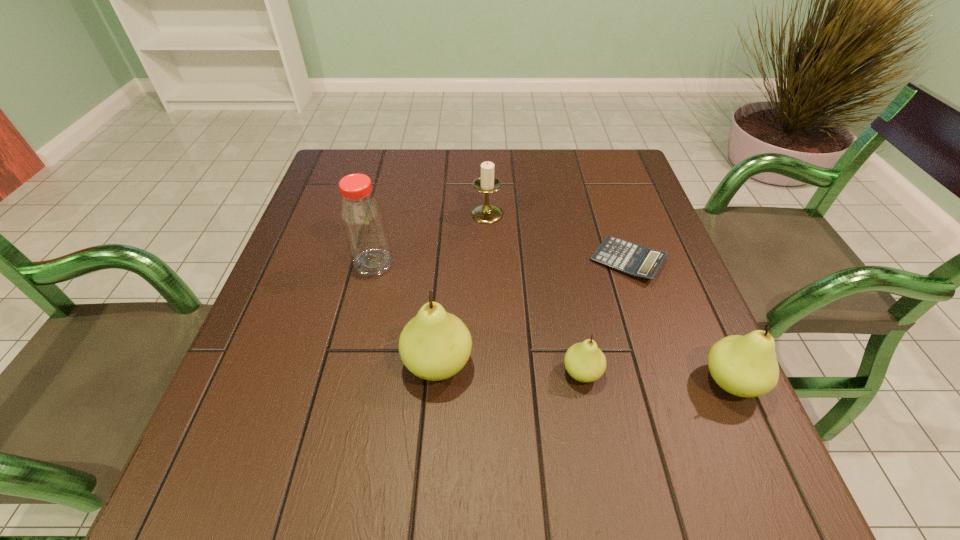
Identify the location of empty location between the farthest object and the leftmost pear. This screenshot has height=540, width=960. (463, 289).

Choose which object is the second nearest neighbor to the bottle. Please provide its 2D coordinates. Your answer should be formatted as a tuple, i.e. [(x, y)], where the tuple contains the x and y coordinates of a point satisfying the conditions above.

[(487, 183)]

Select which object appears as the third closest to the fourth object from left to right. Please provide its 2D coordinates. Your answer should be formatted as a tuple, i.e. [(x, y)], where the tuple contains the x and y coordinates of a point satisfying the conditions above.

[(638, 261)]

Identify the location of pear identified as the closest to the leftmost pear. [585, 362].

Locate which pear ranks in proximity to the rightmost pear. Please provide its 2D coordinates. Your answer should be formatted as a tuple, i.e. [(x, y)], where the tuple contains the x and y coordinates of a point satisfying the conditions above.

[(585, 362)]

You are a GUI agent. You are given a task and a screenshot of the screen. Output one action in this format:
    pyautogui.click(x=<x>, y=<y>)
    Task: Click on the free space that satisfies the following two spatial constraints: 1. on the front side of the leftmost object; 2. on the right side of the leftmost pear
    
    Given the screenshot: What is the action you would take?
    pyautogui.click(x=349, y=364)

At what (x,y) coordinates should I click in order to perform the action: click on free space in the image that satisfies the following two spatial constraints: 1. on the back side of the leftmost pear; 2. on the left side of the farthest object. Please return your answer as a coordinate pair (x, y). Looking at the image, I should click on (449, 214).

This screenshot has width=960, height=540. I want to click on free location that satisfies the following two spatial constraints: 1. on the front side of the candle holder; 2. on the right side of the calculator, so click(488, 260).

Where is `free space that satisfies the following two spatial constraints: 1. on the front side of the farthest object; 2. on the right side of the rightmost pear`? free space that satisfies the following two spatial constraints: 1. on the front side of the farthest object; 2. on the right side of the rightmost pear is located at coordinates (490, 382).